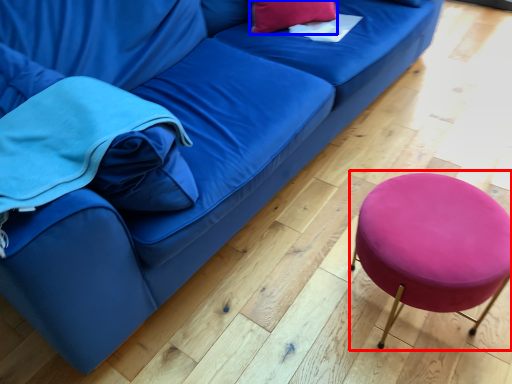
Question: Which object is closer to the camera taking this photo, bar stool (highlighted by a red box) or pillow (highlighted by a blue box)?

Choices:
 (A) bar stool
 (B) pillow

Answer: (A)